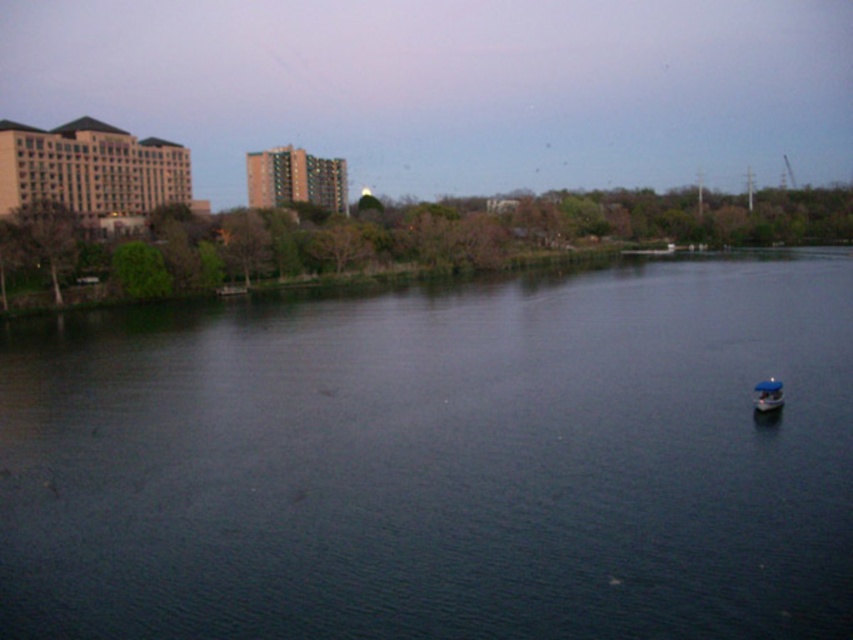
Question: Considering the relative positions of dark blue water at center and blue matte boat at lower right in the image provided, where is dark blue water at center located with respect to blue matte boat at lower right?

Choices:
 (A) right
 (B) left

Answer: (B)

Question: Which object appears farthest from the camera in this image?

Choices:
 (A) dark blue water at center
 (B) blue matte boat at lower right

Answer: (B)

Question: Does dark blue water at center come behind blue matte boat at lower right?

Choices:
 (A) yes
 (B) no

Answer: (B)

Question: Is dark blue water at center below blue matte boat at lower right?

Choices:
 (A) no
 (B) yes

Answer: (A)